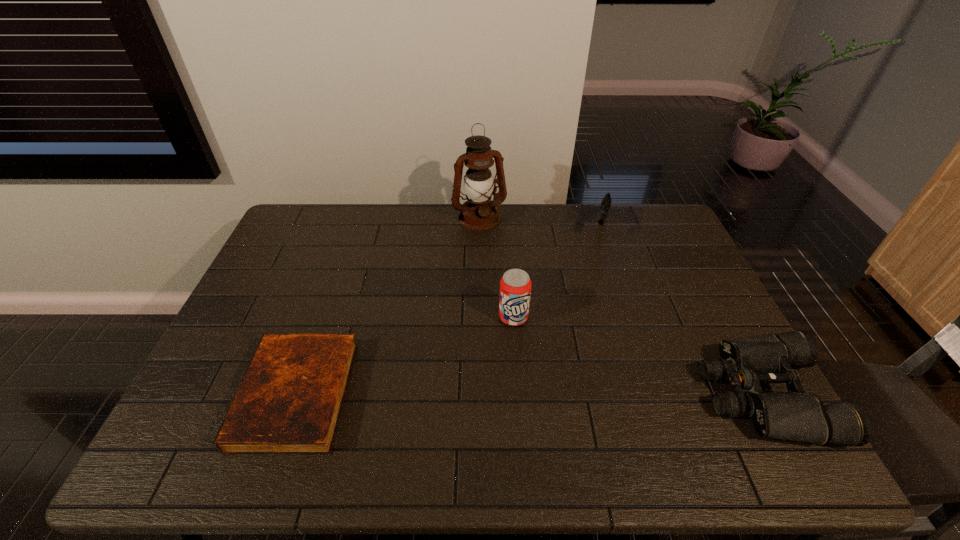
The image size is (960, 540). Identify the location of blank space located on the spine side of the leftmost object. (218, 395).

I want to click on vacant space situated 0.100m on the spine side of the leftmost object, so click(206, 395).

This screenshot has width=960, height=540. In order to click on free space located 0.200m through the eyepieces of the fourth tallest object in this screenshot , I will do `click(624, 395)`.

You are a GUI agent. You are given a task and a screenshot of the screen. Output one action in this format:
    pyautogui.click(x=<x>, y=<y>)
    Task: Click on the vacant area situated 0.240m through the eyepieces of the fourth tallest object
    This screenshot has width=960, height=540.
    Given the screenshot: What is the action you would take?
    pyautogui.click(x=608, y=395)

Locate an element on the screen. The height and width of the screenshot is (540, 960). vacant space located 0.260m through the eyepieces of the fourth tallest object is located at coordinates (600, 395).

The image size is (960, 540). What are the coordinates of `vacant space located 0.260m on the surface of the second tallest object` in the screenshot? It's located at (530, 412).

Find the location of a particular element. The width and height of the screenshot is (960, 540). vacant space located on the surface of the second tallest object is located at coordinates (527, 394).

You are a GUI agent. You are given a task and a screenshot of the screen. Output one action in this format:
    pyautogui.click(x=<x>, y=<y>)
    Task: Click on the free region located 0.270m on the surface of the second tallest object
    
    Given the screenshot: What is the action you would take?
    pyautogui.click(x=531, y=416)

In order to click on free spot located 0.190m on the side of the tallest object, there is a wick adjustment knob in this screenshot , I will do `click(502, 265)`.

I want to click on vacant area located on the side of the tallest object, there is a wick adjustment knob, so click(x=504, y=271).